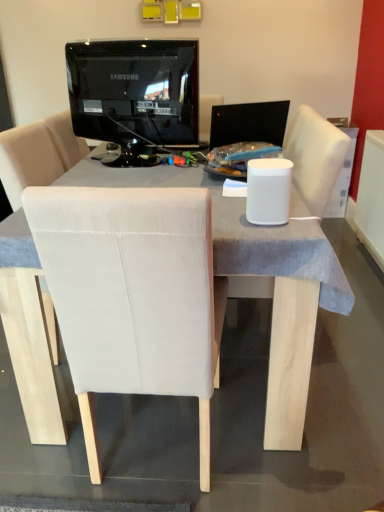
Question: Is black glossy monitor at center facing towards black glossy monitor at upper center?

Choices:
 (A) no
 (B) yes

Answer: (A)

Question: Is black glossy monitor at center turned away from black glossy monitor at upper center?

Choices:
 (A) no
 (B) yes

Answer: (A)

Question: Is black glossy monitor at center closer to camera compared to black glossy monitor at upper center?

Choices:
 (A) yes
 (B) no

Answer: (B)

Question: From a real-world perspective, is black glossy monitor at center positioned over black glossy monitor at upper center based on gravity?

Choices:
 (A) no
 (B) yes

Answer: (A)

Question: Considering the relative sizes of black glossy monitor at center and black glossy monitor at upper center in the image provided, is black glossy monitor at center bigger than black glossy monitor at upper center?

Choices:
 (A) yes
 (B) no

Answer: (B)

Question: From a real-world perspective, relative to black glossy monitor at center, is white plastic radiator at right vertically above or below?

Choices:
 (A) below
 (B) above

Answer: (A)

Question: Is white plastic radiator at right spatially inside black glossy monitor at center, or outside of it?

Choices:
 (A) outside
 (B) inside

Answer: (A)

Question: Looking at their shapes, would you say white plastic radiator at right is wider or thinner than black glossy monitor at center?

Choices:
 (A) thin
 (B) wide

Answer: (A)

Question: Considering their positions, is white plastic radiator at right located in front of or behind black glossy monitor at center?

Choices:
 (A) behind
 (B) front

Answer: (A)

Question: Is white plastic radiator at right inside or outside of black glossy monitor at upper center?

Choices:
 (A) outside
 (B) inside

Answer: (A)

Question: Is point (375, 226) positioned closer to the camera than point (84, 104)?

Choices:
 (A) closer
 (B) farther

Answer: (B)

Question: Is white plastic radiator at right to the left or to the right of black glossy monitor at upper center in the image?

Choices:
 (A) left
 (B) right

Answer: (B)

Question: Looking at the image, does white plastic radiator at right seem bigger or smaller compared to black glossy monitor at upper center?

Choices:
 (A) small
 (B) big

Answer: (A)

Question: Would you say black glossy monitor at upper center is to the left or to the right of white plastic radiator at right in the picture?

Choices:
 (A) left
 (B) right

Answer: (A)

Question: From the image's perspective, is black glossy monitor at upper center positioned above or below white plastic radiator at right?

Choices:
 (A) below
 (B) above

Answer: (B)